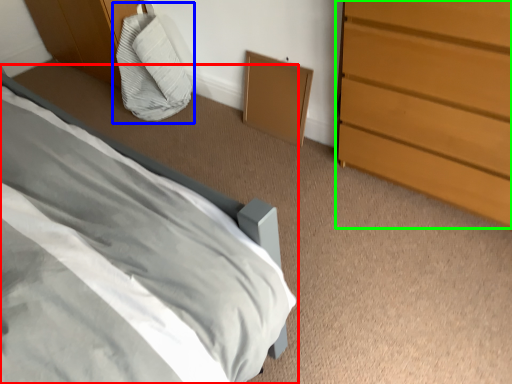
Question: Which object is positioned farthest from bed (highlighted by a red box)? Select from bean bag chair (highlighted by a blue box) and chest of drawers (highlighted by a green box).

Choices:
 (A) bean bag chair
 (B) chest of drawers

Answer: (A)